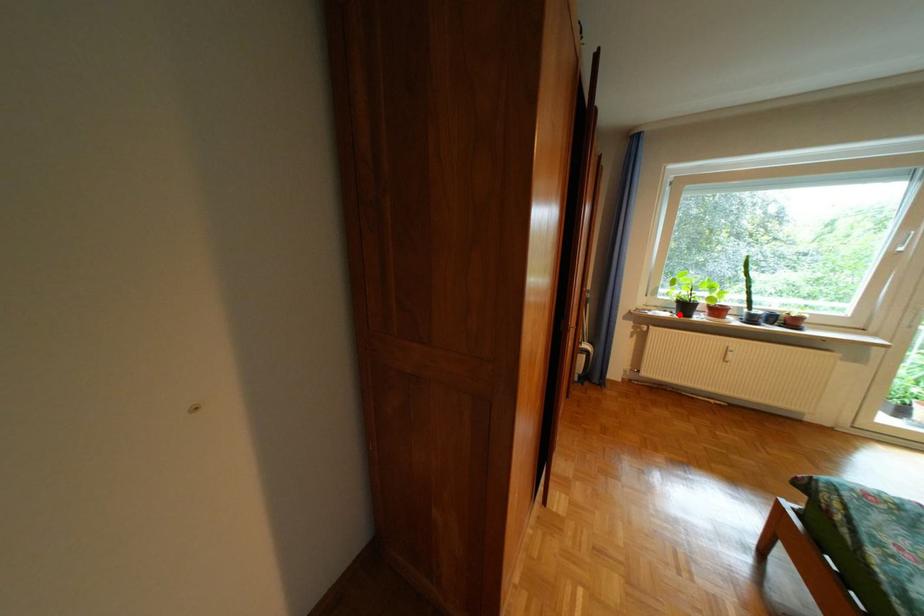
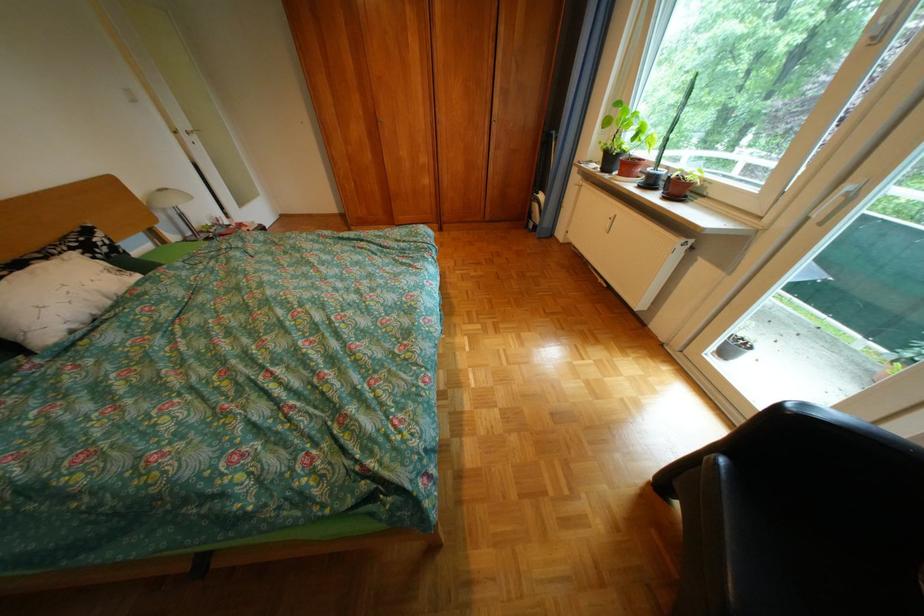
The point at the highlighted location is marked in the first image. Where is the corresponding point in the second image?

(610, 168)